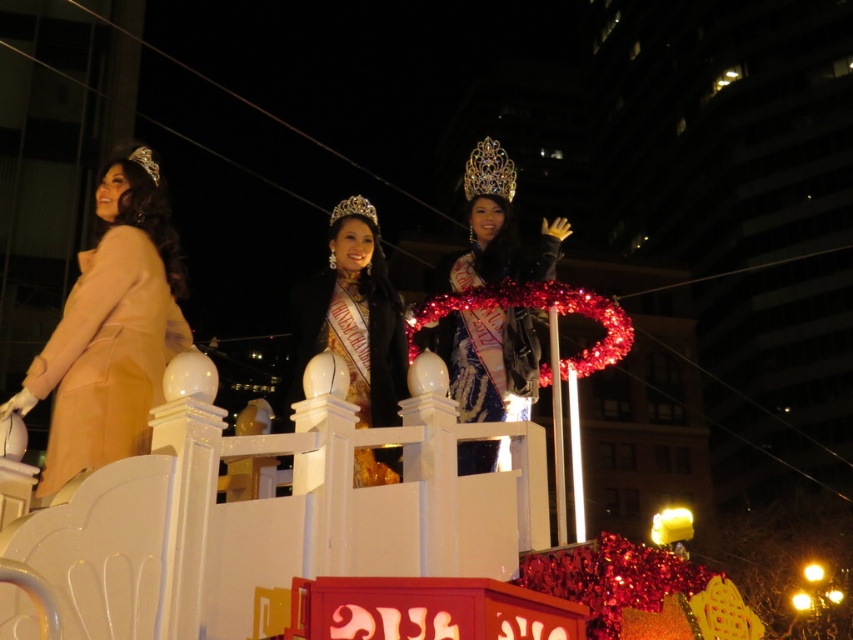
You are a photographer at the event and need to take a group photo of the beige satin coat at left and the shiny blue dress at center. Since you want to ensure both are visible clearly, which one should you focus on first to avoid blurriness due to their size?

The beige satin coat at left is larger in size than the shiny blue dress at center, so you should focus on the beige satin coat at left first to ensure clarity.

You are a photographer standing at the center of the float. You want to take a photo of the beige satin coat at left. Where should you position yourself to ensure the coat is in the frame?

The beige satin coat at left is located at point [111,328], so you should position yourself facing the left side of the float to capture it in the frame.

You are a photographer taking pictures of the float. You notice the shiny blue dress at center and the gold satin sash at center. Which one is positioned higher relative to the other?

The shiny blue dress at center is located above the gold satin sash at center, so it is positioned higher.